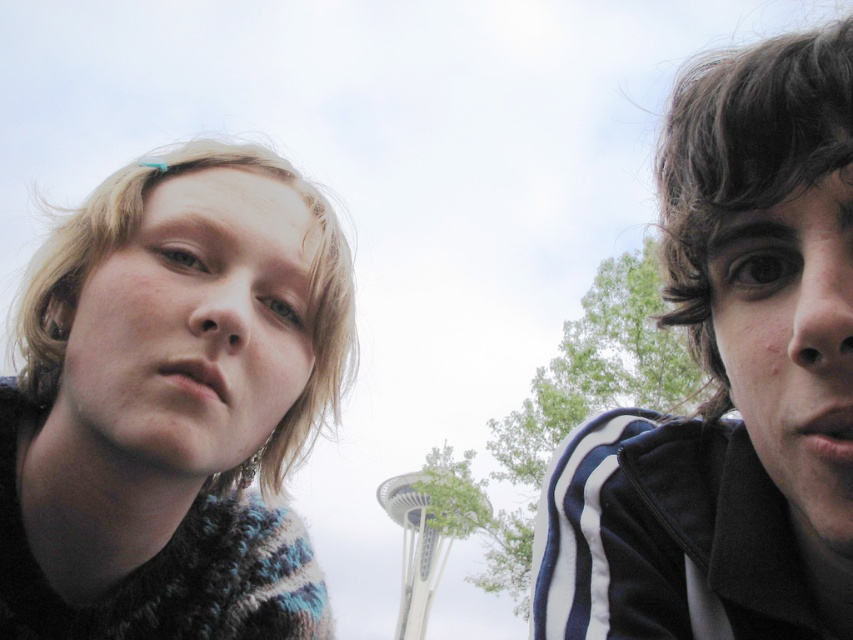
You are standing at the base of the Space Needle and looking up. There is a point marked at coordinates (729, 380). Which object from the scene is located at that point?

The dark brown hair at upper right is located at point (729, 380).

You are standing in the park and see two people in the distance. The person with dark brown hair at upper right and the person with knitted sweater at left. Which person is closer to you?

The dark brown hair at upper right is closer to you because it is in front of the knitted sweater at left.

You are a photographer trying to capture a clear shot of both the dark brown hair at upper right and the knitted sweater at left. Since the Space Needle is in the background, you need to adjust your camera angle. Which object should you focus on first to ensure both are in frame?

The dark brown hair at upper right is positioned over the knitted sweater at left, so you should focus on the knitted sweater at left first to ensure both are in frame.